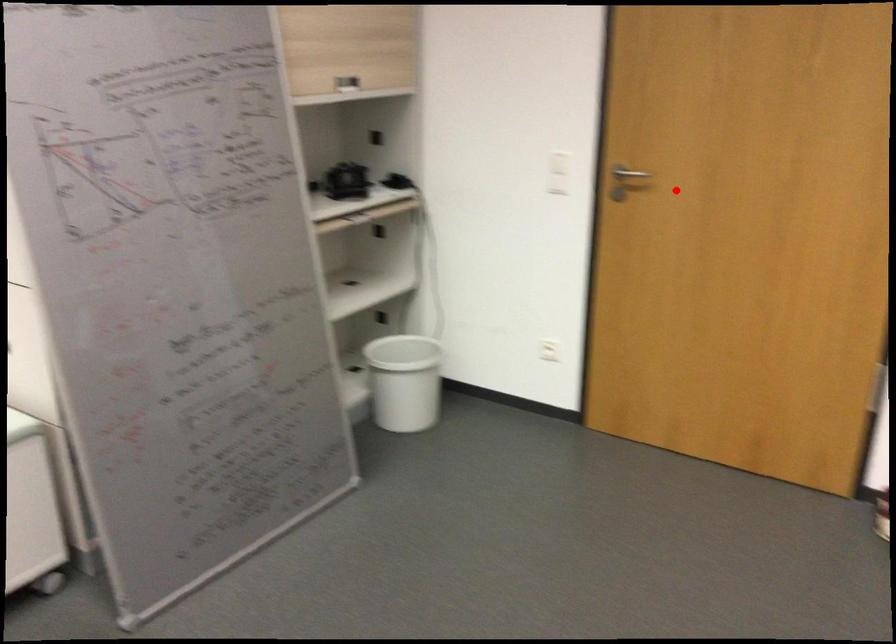
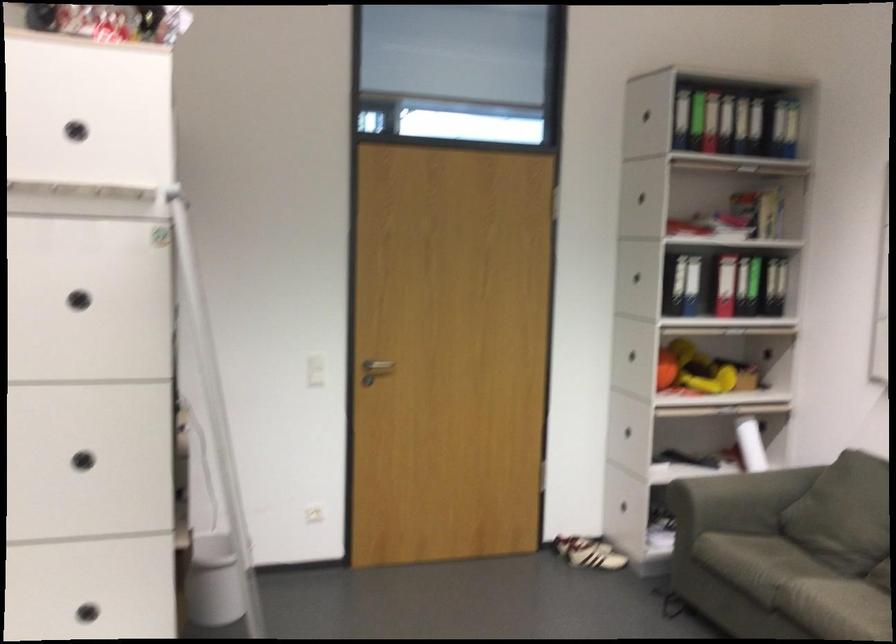
Find the pixel in the second image that matches the highlighted location in the first image.

(374, 370)